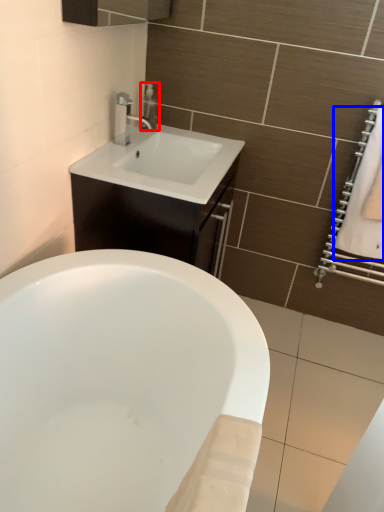
Question: Which point is closer to the camera, soap dispenser (highlighted by a red box) or bath towel (highlighted by a blue box)?

Choices:
 (A) soap dispenser
 (B) bath towel

Answer: (B)